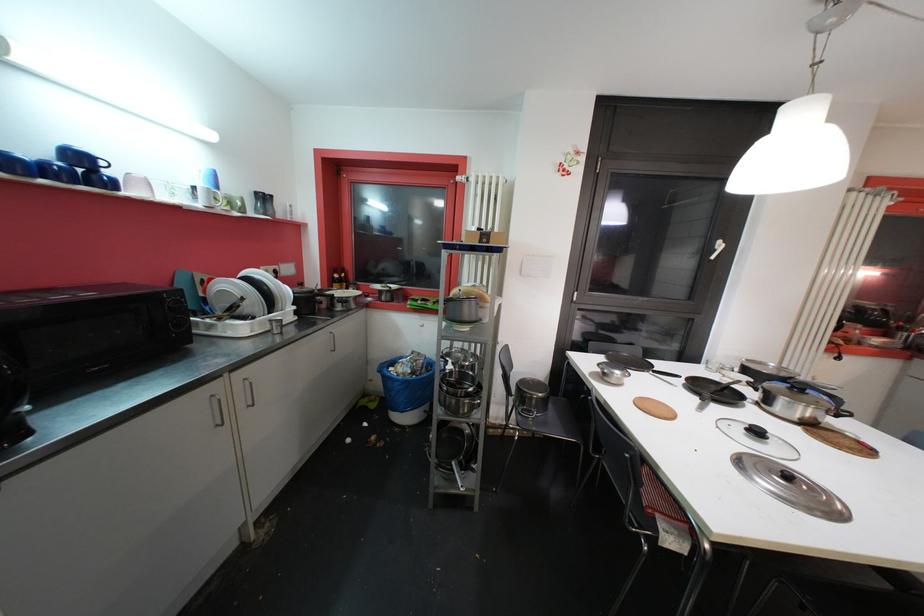
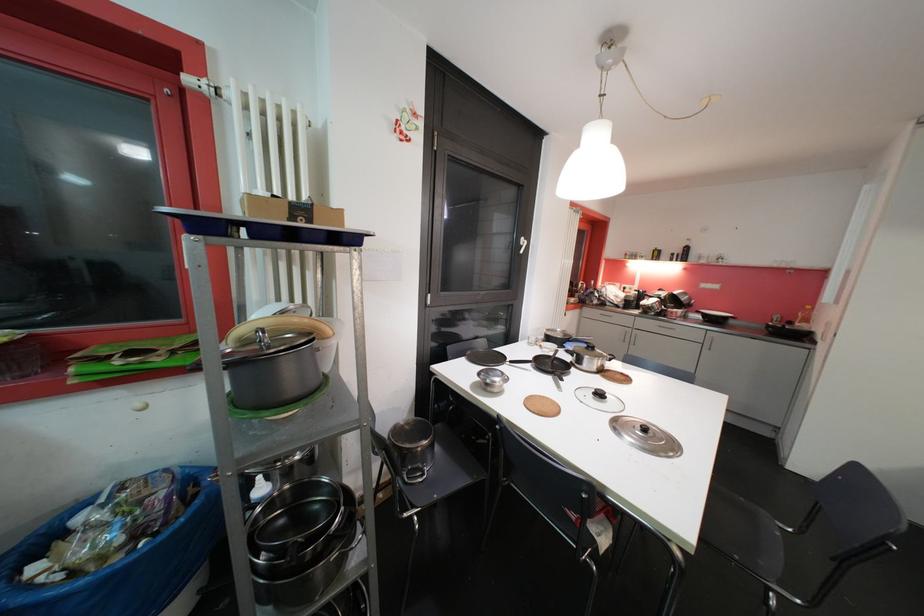
Find the pixel in the second image that matches pixel 660 374 in the first image.

(516, 363)